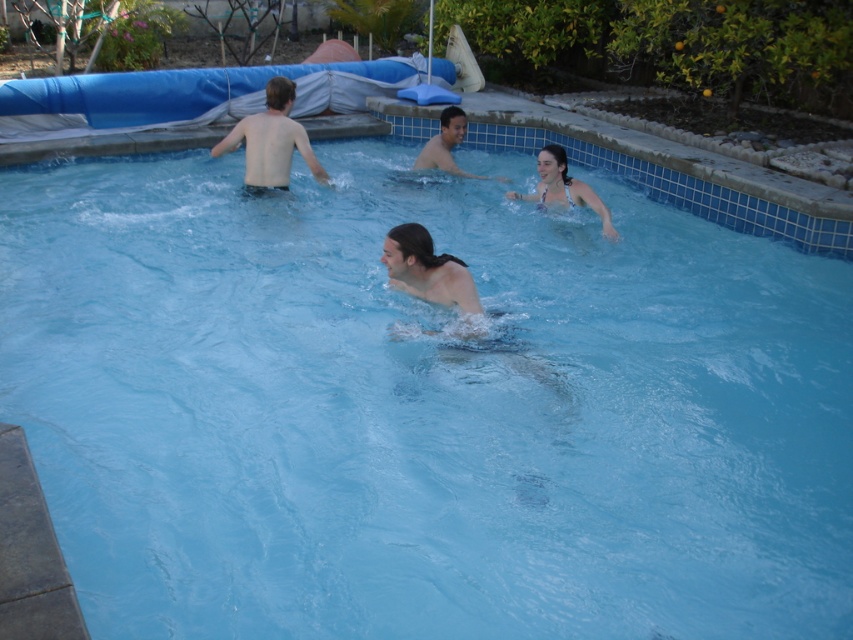
Question: Is white bikini at center wider than smooth skin man at center?

Choices:
 (A) yes
 (B) no

Answer: (B)

Question: Can you confirm if smooth skin man at upper left is positioned to the right of smooth skin man at center?

Choices:
 (A) yes
 (B) no

Answer: (B)

Question: Considering the real-world distances, which object is closest to the smooth skin man at center?

Choices:
 (A) white bikini at center
 (B) smooth skin man at upper left

Answer: (A)

Question: Is smooth skin man at upper left positioned before smooth skin man at center?

Choices:
 (A) no
 (B) yes

Answer: (B)

Question: Among these points, which one is nearest to the camera?

Choices:
 (A) (456, 131)
 (B) (258, 188)

Answer: (B)

Question: Which is farther from the white bikini at center?

Choices:
 (A) smooth skin man at center
 (B) smooth skin man at upper left

Answer: (B)